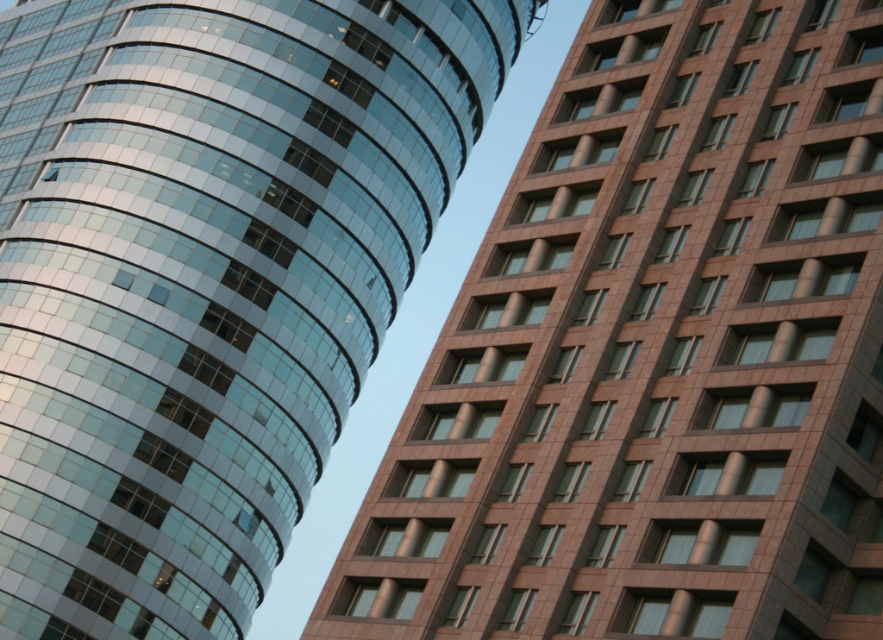
You are a drone operator who needs to fly a drone between the glassy reflective tower at left and the shiny glass building at upper left. The drone has a maximum flight distance of 30 meters. Can you safely fly the drone between them without exceeding its range?

The distance between the glassy reflective tower at left and the shiny glass building at upper left is 29.09 meters, which is within the drone operator maximum flight distance of 30 meters. Therefore, the drone can safely fly between them without exceeding its range.

Looking at this image, you are standing at the center of the image and want to locate the glassy reflective tower at left. What are the coordinates of its position?

The glassy reflective tower at left is located at coordinates point (655, 353).

You are a drone operator who needs to fly a drone from the glassy reflective tower at left to the shiny glass building at upper left. According to the scene, which direction should you fly the drone to reach the destination?

The glassy reflective tower at left is located below the shiny glass building at upper left, so you should fly the drone upward to reach the shiny glass building at upper left.